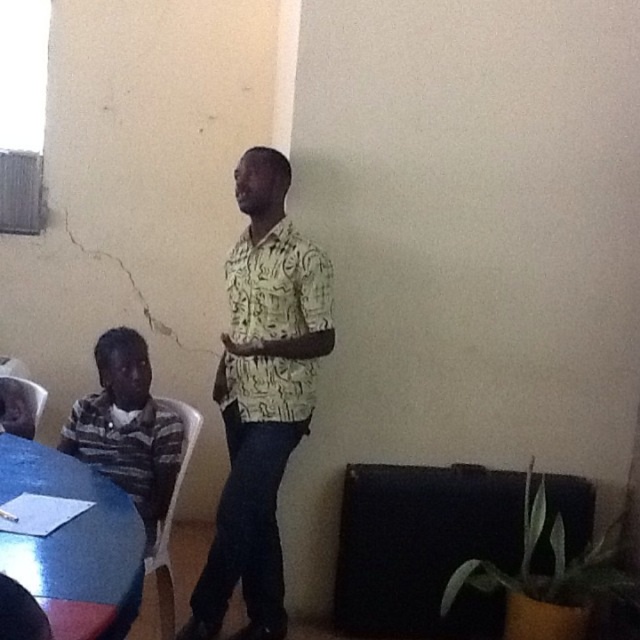
Is yellow printed shirt at center positioned behind smooth glossy wood table at lower left?

Yes.

Is yellow printed shirt at center above smooth glossy wood table at lower left?

Indeed, yellow printed shirt at center is positioned over smooth glossy wood table at lower left.

Who is more distant from viewer, [269,305] or [17,572]?

Point [269,305]

Locate an element on the screen. The height and width of the screenshot is (640, 640). yellow printed shirt at center is located at coordinates (260, 396).